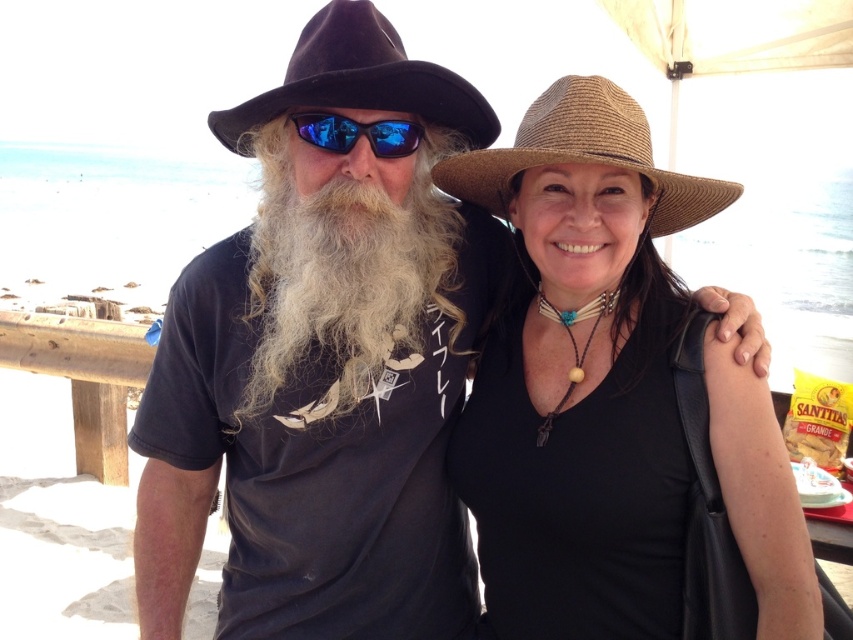
You are at a beach event and want to place a small flag between the two points, point (643,406) and point (376,147). Which point should the flag be closer to if you want it to be in front of the other point?

The flag should be closer to point (376,147) because point (643,406) is behind it, so placing the flag near the front point would ensure it is in front of the other point.

You are at a beach event and notice the brown straw hat at upper center. Where exactly is it positioned relative to the other objects in the scene?

The brown straw hat at upper center is located at point coordinates 0.588 on the x axis and 0.681 on the y axis.

You are a photographer trying to capture a clear shot of the blue reflective lenses at center. However, the brown straw hat at upper center is blocking your view. Can you adjust your angle to avoid the hat and still see the lenses?

The brown straw hat at upper center is positioned under the blue reflective lenses at center, so adjusting your angle downward might allow you to see the lenses without the hat obstructing the view.